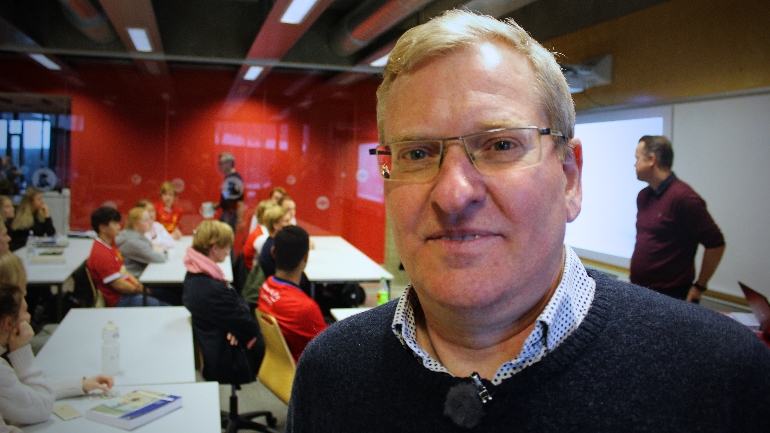
You are a GUI agent. You are given a task and a screenshot of the screen. Output one action in this format:
    pyautogui.click(x=<x>, y=<y>)
    Task: Click on the bright white projection on a projection screen
    
    Given the screenshot: What is the action you would take?
    pyautogui.click(x=623, y=143), pyautogui.click(x=620, y=235), pyautogui.click(x=576, y=231), pyautogui.click(x=591, y=144)